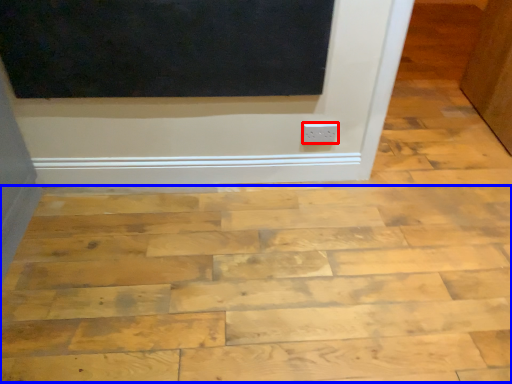
Question: Which object appears closest to the camera in this image, electric outlet (highlighted by a red box) or plywood (highlighted by a blue box)?

Choices:
 (A) electric outlet
 (B) plywood

Answer: (B)